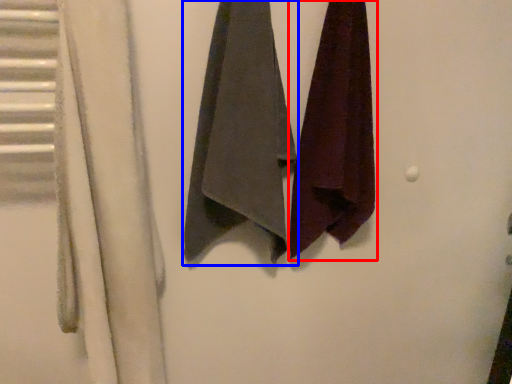
Question: Which object appears farthest to the camera in this image, towel (highlighted by a red box) or towel (highlighted by a blue box)?

Choices:
 (A) towel
 (B) towel

Answer: (A)